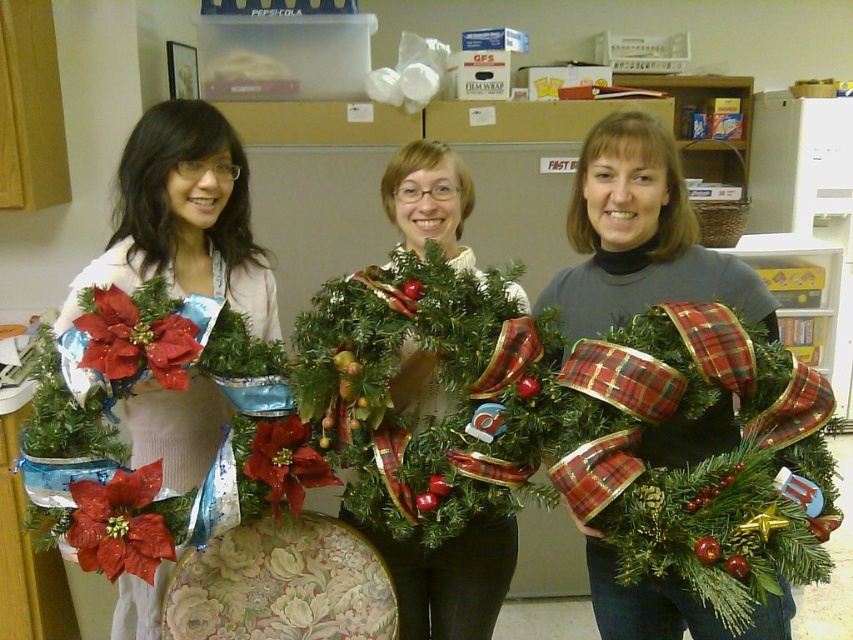
Based on the photo, you are organizing a holiday display and need to place the shiny red ribbon at center and the green matte wreath at center. Based on their positions in the image, which object is closer to you?

The shiny red ribbon at center is closer to you because it is in front of the green matte wreath at center.

You are organizing a holiday display and need to ensure the green matte wreath at center and the matte white sweater at center will fit on a shelf. Based on their sizes, can you determine if the wreath will fit without overlapping the sweater?

The green matte wreath at center might be wider than matte white sweater at center, so there is a possibility that the wreath could overlap the sweater if placed adjacent to each other on the shelf.